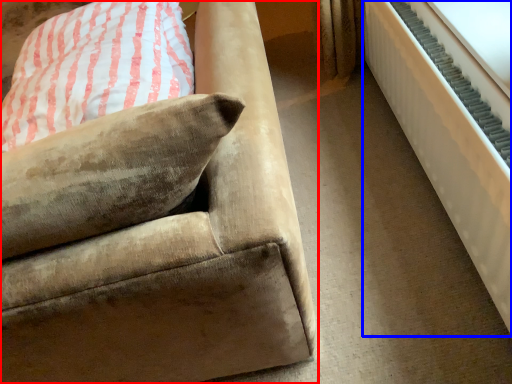
Question: Which point is further to the camera, studio couch (highlighted by a red box) or radiator (highlighted by a blue box)?

Choices:
 (A) studio couch
 (B) radiator

Answer: (B)